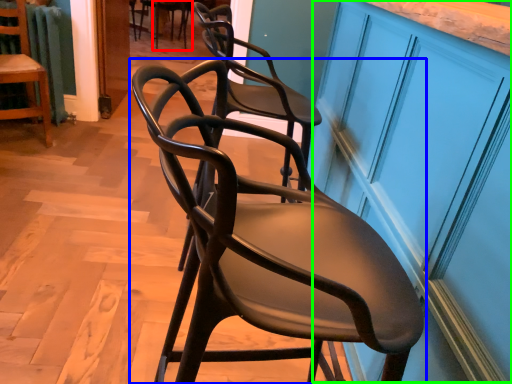
Question: Estimate the real-world distances between objects in this image. Which object is closer to chair (highlighted by a red box), chair (highlighted by a blue box) or cabinetry (highlighted by a green box)?

Choices:
 (A) chair
 (B) cabinetry

Answer: (B)